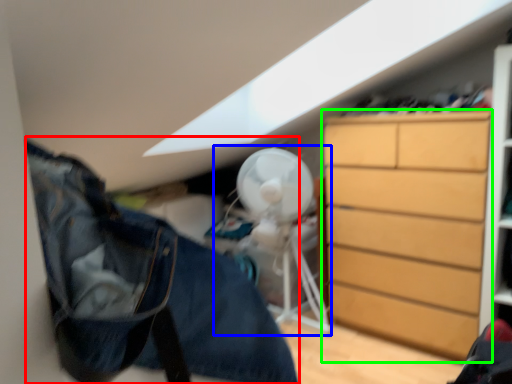
Question: Which object is positioned closest to clothing (highlighted by a red box)? Select from mechanical fan (highlighted by a blue box) and chest of drawers (highlighted by a green box).

Choices:
 (A) mechanical fan
 (B) chest of drawers

Answer: (B)